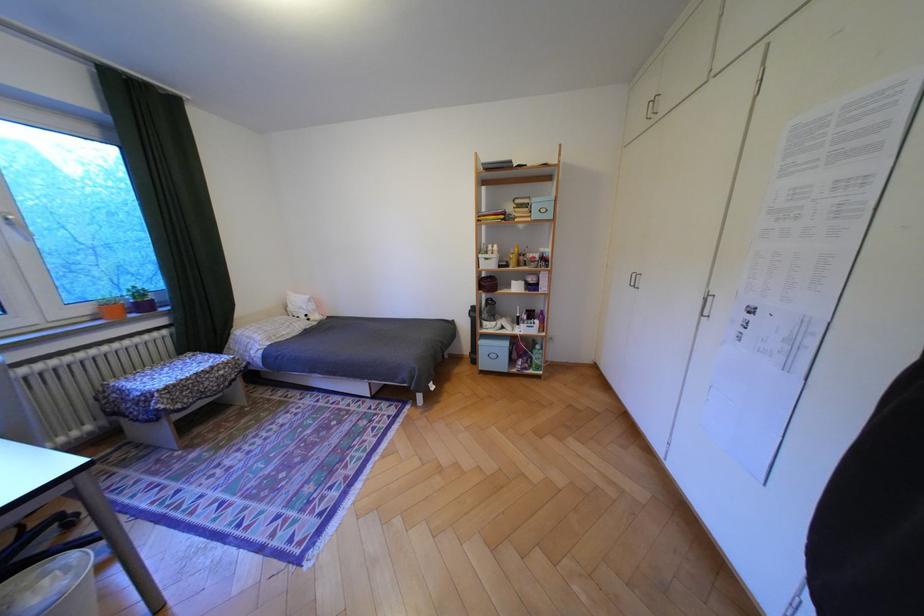
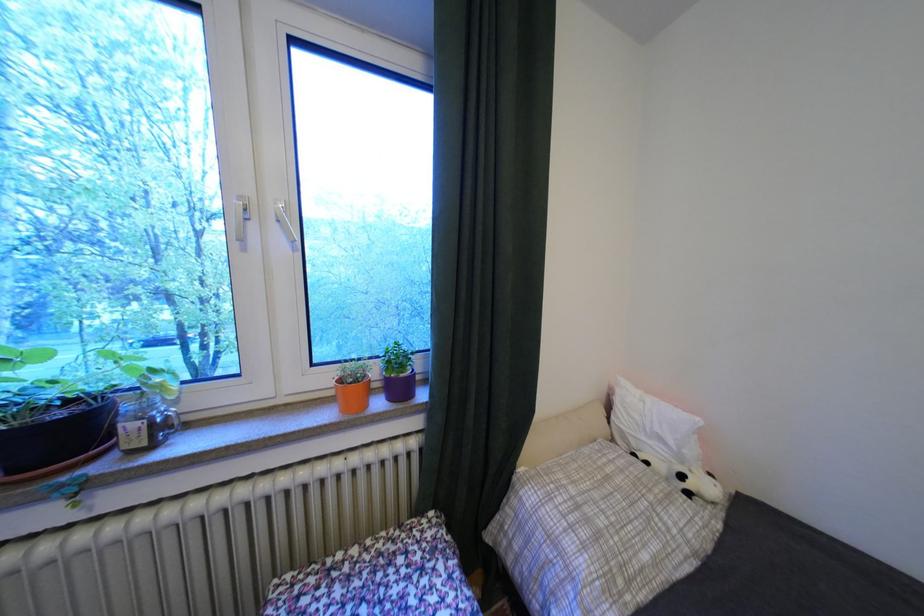
Where in the second image is the point corresponding to (300,334) from the first image?

(667, 562)